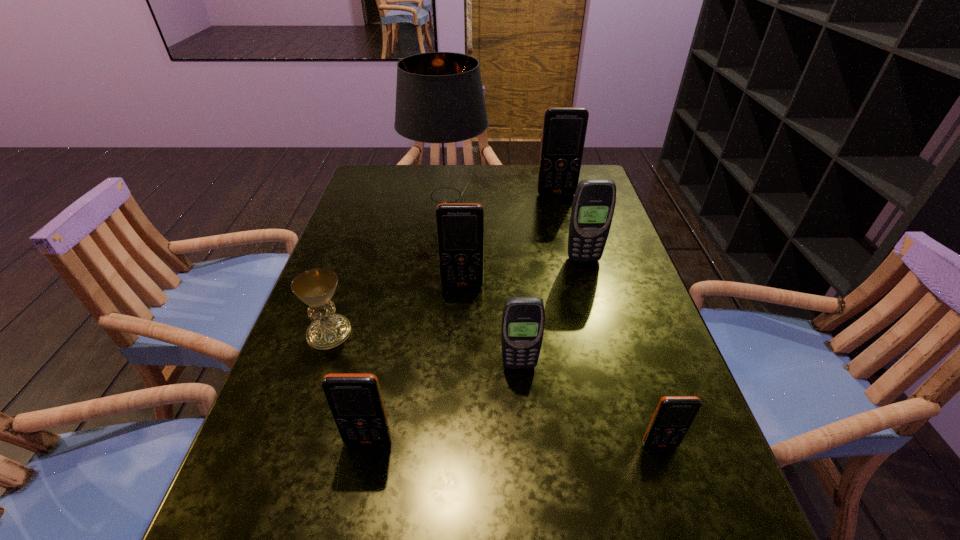
What are the coordinates of `vacant point located 0.050m on the screen of the leftmost orange cellular telephone` in the screenshot? It's located at (361, 476).

Find the location of `free space located on the front of the fifth farthest object`. free space located on the front of the fifth farthest object is located at coordinates (289, 453).

In order to click on free space located 0.050m on the screen of the shortest cellular telephone in this screenshot , I will do `click(671, 479)`.

This screenshot has width=960, height=540. Identify the location of lampshade that is positioned at the far edge. (440, 106).

Image resolution: width=960 pixels, height=540 pixels. Find the location of `cellular telephone located at the far edge`. cellular telephone located at the far edge is located at coordinates [x=564, y=128].

In order to click on lampshade at the left edge in this screenshot , I will do `click(440, 106)`.

Find the location of a particular element. This screenshot has width=960, height=540. cellular telephone at the left edge is located at coordinates (355, 400).

Where is `chalice present at the left edge`? chalice present at the left edge is located at coordinates (316, 287).

Where is `object that is at the far left corner`? The image size is (960, 540). object that is at the far left corner is located at coordinates (440, 106).

I want to click on object present at the far right corner, so click(564, 128).